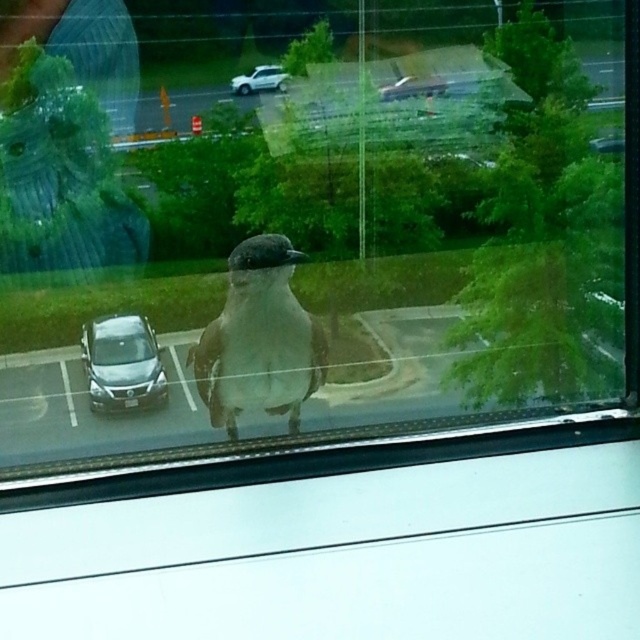
Looking at this image, you are a delivery person who needs to reach the satin silver car at lower left without disturbing the gray matte bird at center. The minimum safe distance to maintain from the bird is 10 feet. Can you safely approach the car from your current position?

The gray matte bird at center is 9.77 feet from the satin silver car at lower left. Since the minimum safe distance is 10 feet, approaching the car would bring you within the safety zone of the bird. Therefore, you cannot safely approach the car without disturbing the gray matte bird at center.

You are a delivery person who needs to park a 2.5 meter wide truck in the parking lot. You see the satin silver car at lower left and the white matte car at center. Which parking spot between them has enough width for your truck?

The satin silver car at lower left might be wider than white matte car at center, so the parking spot next to the white matte car at center is likely wider and can accommodate the truck.

You are standing in front of a window and see a gray matte bird at center and a white matte car at center. Which object is positioned to the right side from your perspective?

The gray matte bird at center is to the right of the white matte car at center.